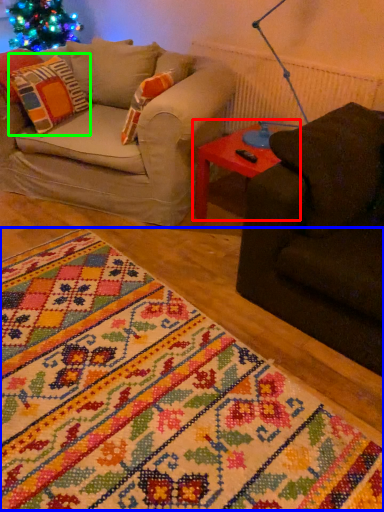
Question: Based on their relative distances, which object is nearer to table (highlighted by a red box)? Choose from blanket (highlighted by a blue box) and pillow (highlighted by a green box).

Choices:
 (A) blanket
 (B) pillow

Answer: (B)